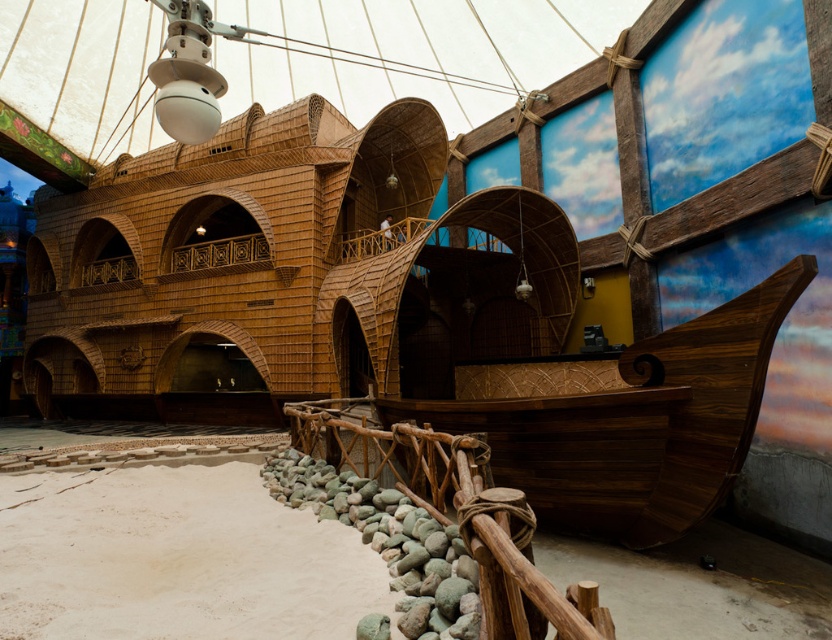
You are a visitor walking on the white sand at lower center and want to reach the rustic wood rail at lower center. According to the scene description, which direction should you move to reach the rail?

The white sand at lower center is positioned under the rustic wood rail at lower center, so you should move upward to reach the rustic wood rail at lower center.

You are a visitor exploring the nautical exhibit and want to walk from the entrance to the observation deck. There is white sand at lower center and a rustic wood rail at lower center in your path. Which object is lower, and would stepping over it be necessary?

The white sand at lower center has a lesser height compared to rustic wood rail at lower center. Since the sand is lower, you would need to step over the rustic wood rail at lower center if it obstructs your path.

You are standing at the entrance of the nautical exhibit and want to walk towards the white sand at lower center. According to the coordinates provided, where exactly should you aim to step on the sand?

The white sand at lower center is located at coordinates point (176,557), so you should aim to step at that exact point to reach it.